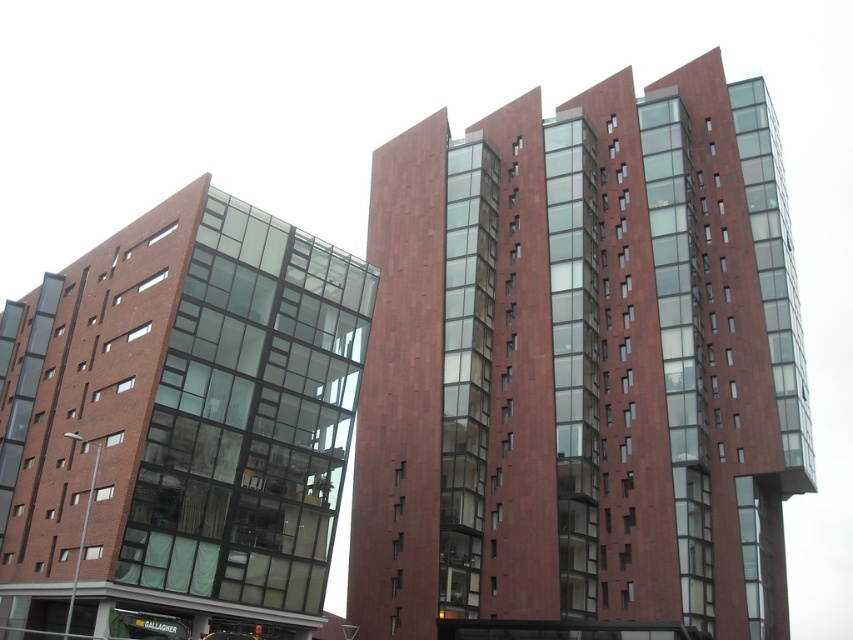
Question: Which point is closer to the camera?

Choices:
 (A) (396, 339)
 (B) (96, 336)

Answer: (B)

Question: Is red brick building at center positioned behind matte brick building at left?

Choices:
 (A) yes
 (B) no

Answer: (A)

Question: Can you confirm if red brick building at center is thinner than matte brick building at left?

Choices:
 (A) yes
 (B) no

Answer: (B)

Question: From the image, what is the correct spatial relationship of red brick building at center in relation to matte brick building at left?

Choices:
 (A) right
 (B) left

Answer: (A)

Question: Which point is farther from the camera taking this photo?

Choices:
 (A) (434, 545)
 (B) (78, 572)

Answer: (A)